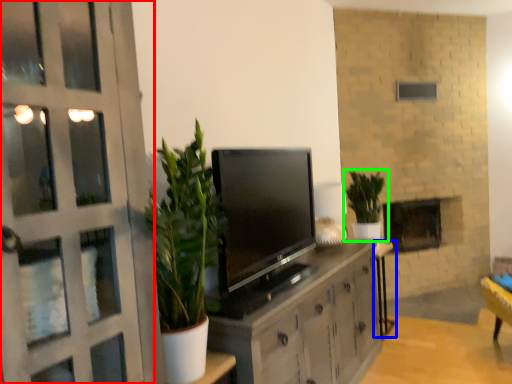
Question: Based on their relative distances, which object is farther from door (highlighted by a red box)? Choose from table (highlighted by a blue box) and houseplant (highlighted by a green box).

Choices:
 (A) table
 (B) houseplant

Answer: (A)